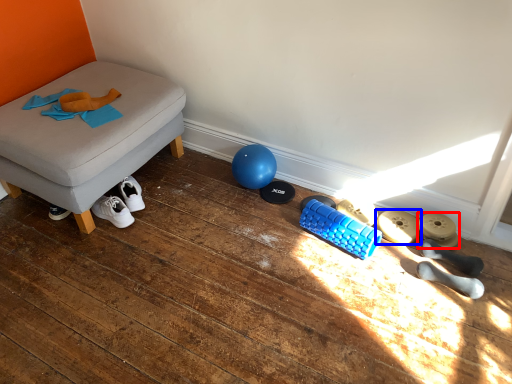
Question: Which object appears farthest to the camera in this image, footwear (highlighted by a red box) or footwear (highlighted by a blue box)?

Choices:
 (A) footwear
 (B) footwear

Answer: (B)